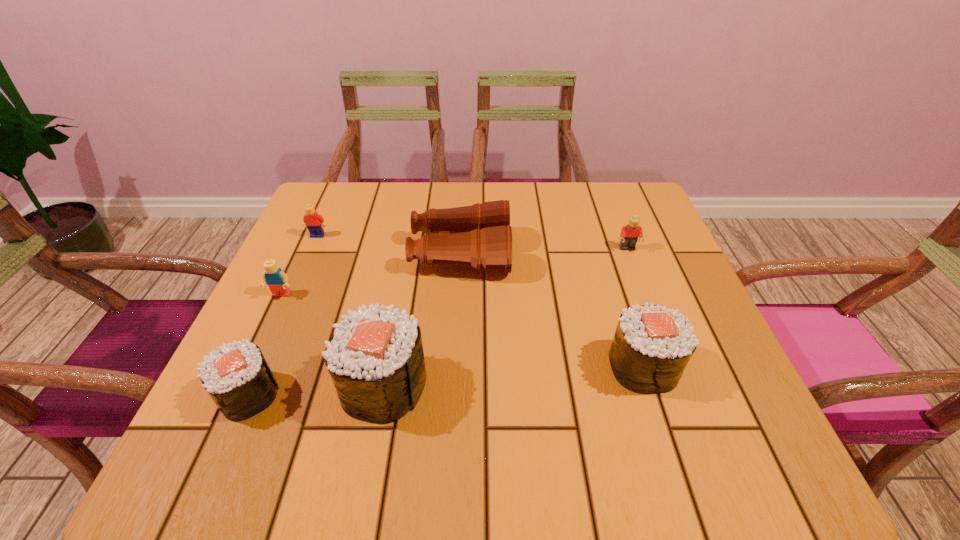
Image resolution: width=960 pixels, height=540 pixels. I want to click on object that is positioned at the far left corner, so (x=315, y=223).

What are the coordinates of `object located in the near left corner section of the desktop` in the screenshot? It's located at (237, 377).

Find the location of a particular element. The height and width of the screenshot is (540, 960). object present at the near right corner is located at coordinates (652, 345).

In the image, there is a desktop. Where is `vacant space at the far edge`? This screenshot has width=960, height=540. vacant space at the far edge is located at coordinates (382, 199).

Locate an element on the screen. The image size is (960, 540). blank space at the left edge is located at coordinates (330, 256).

I want to click on free space at the right edge of the desktop, so click(665, 262).

Find the location of a particular element. The height and width of the screenshot is (540, 960). free space at the far left corner of the desktop is located at coordinates (357, 186).

In the image, there is a desktop. In order to click on vacant space at the far right corner in this screenshot , I will do `click(590, 185)`.

Locate an element on the screen. This screenshot has height=540, width=960. free space at the near right corner of the desktop is located at coordinates (676, 407).

Locate an element on the screen. This screenshot has width=960, height=540. empty space that is in between the fourth farthest object and the farthest Lego is located at coordinates (300, 265).